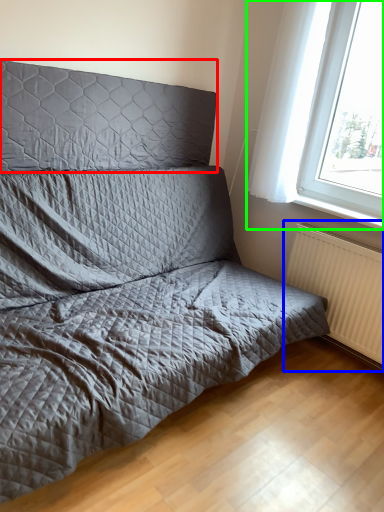
Question: Which is farther away from headboard (highlighted by a red box)? radiator (highlighted by a blue box) or window (highlighted by a green box)?

Choices:
 (A) radiator
 (B) window

Answer: (A)